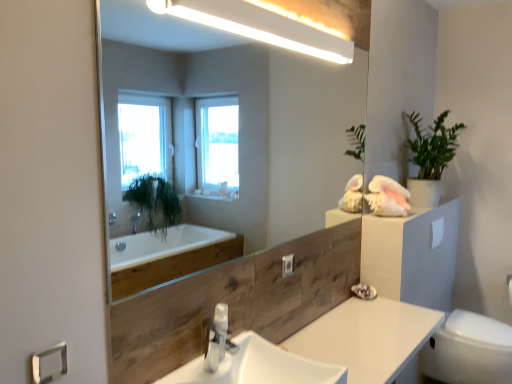
Identify the location of vacant space situated on the left part of satin nickel faucet at center. (188, 373).